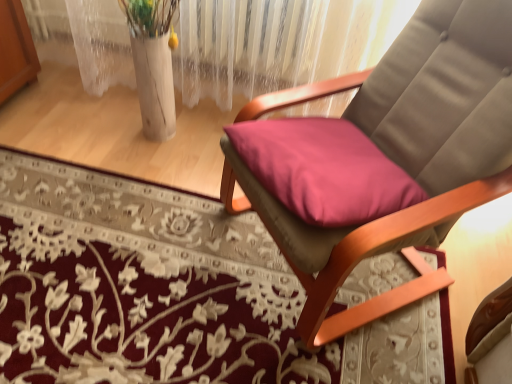
The width and height of the screenshot is (512, 384). I want to click on free space above floral carpet at center (from a real-world perspective), so click(145, 270).